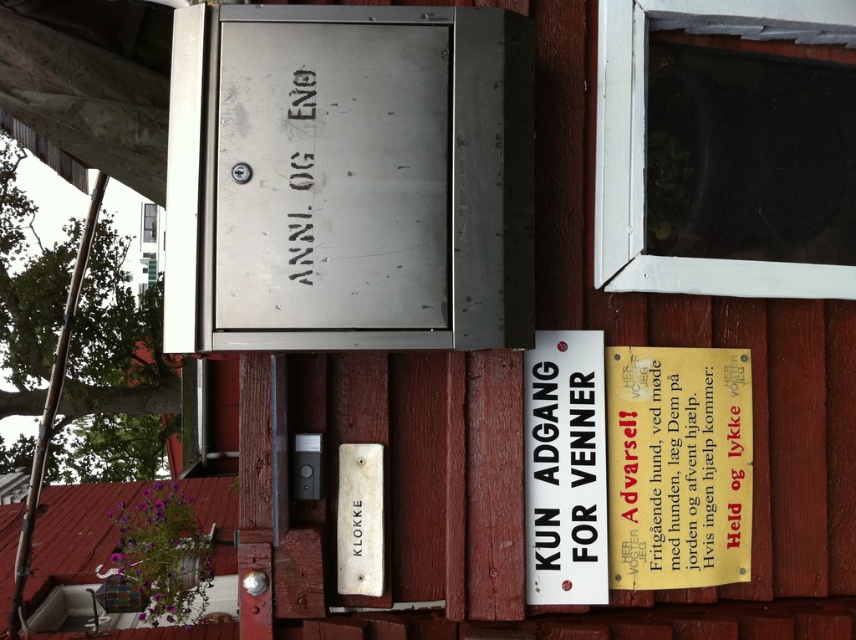
Is metallic warning sign at right smaller than black metallic text at upper center?

Actually, metallic warning sign at right might be larger than black metallic text at upper center.

Is point (676, 480) positioned before point (301, 86)?

No.

Who is more forward, (x=693, y=355) or (x=292, y=106)?

Point (x=292, y=106)

The width and height of the screenshot is (856, 640). What are the coordinates of `metallic warning sign at right` in the screenshot? It's located at (678, 467).

Can you confirm if metallic warning sign at right is smaller than white plastic sign at center?

No, metallic warning sign at right is not smaller than white plastic sign at center.

Is point (682, 390) positioned after point (584, 538)?

Yes, point (682, 390) is farther from viewer.

You are a GUI agent. You are given a task and a screenshot of the screen. Output one action in this format:
    pyautogui.click(x=<x>, y=<y>)
    Task: Click on the metallic warning sign at right
    Image resolution: width=856 pixels, height=640 pixels.
    Given the screenshot: What is the action you would take?
    pyautogui.click(x=678, y=467)

Is white plastic sign at center positioned behind black metallic text at upper center?

Yes, it is behind black metallic text at upper center.

Can you confirm if white plastic sign at center is positioned to the right of black metallic text at upper center?

Correct, you'll find white plastic sign at center to the right of black metallic text at upper center.

Which is in front, point (580, 528) or point (296, 173)?

Point (296, 173) is more forward.

Locate an element on the screen. The height and width of the screenshot is (640, 856). white plastic sign at center is located at coordinates (565, 468).